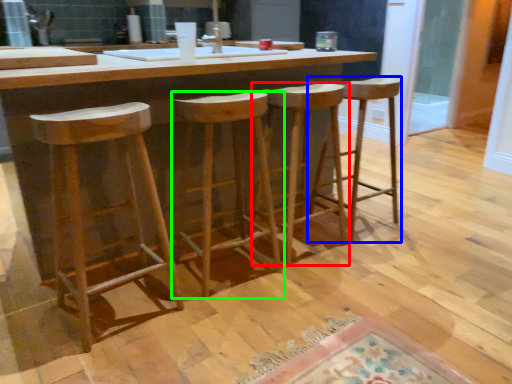
Question: Estimate the real-world distances between objects in this image. Which object is farther from stool (highlighted by a red box), stool (highlighted by a blue box) or stool (highlighted by a green box)?

Choices:
 (A) stool
 (B) stool

Answer: (B)